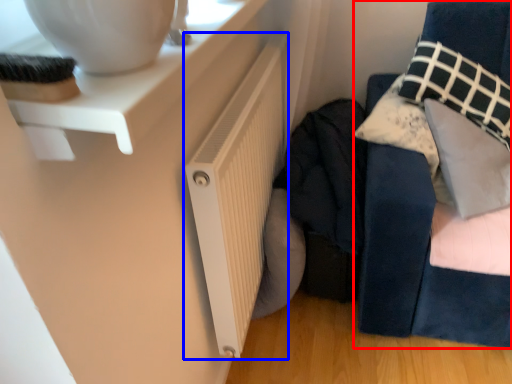
Question: Which object is further to the camera taking this photo, furniture (highlighted by a red box) or radiator (highlighted by a blue box)?

Choices:
 (A) furniture
 (B) radiator

Answer: (A)